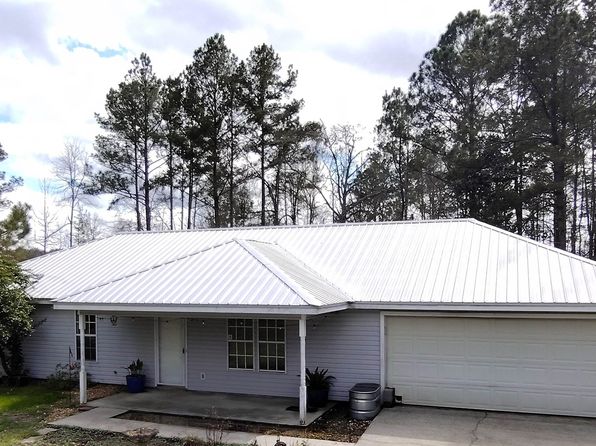
Where is `door`? The height and width of the screenshot is (446, 596). door is located at coordinates tap(173, 331).